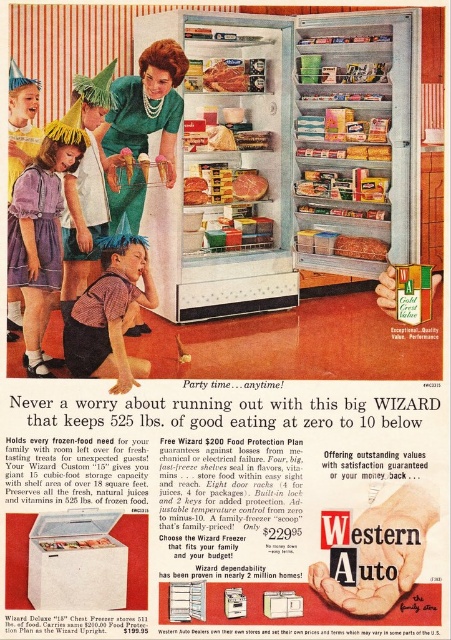
You are a photographer setting up for a family photo shoot in the scene. You need to position a small prop between the purple cotton dress at lower left and the matte yellow party hat at lower left so it doesn

The purple cotton dress at lower left is taller than the matte yellow party hat at lower left. Therefore, the prop should be placed between them at a height that accommodates both objects, ensuring it doesn